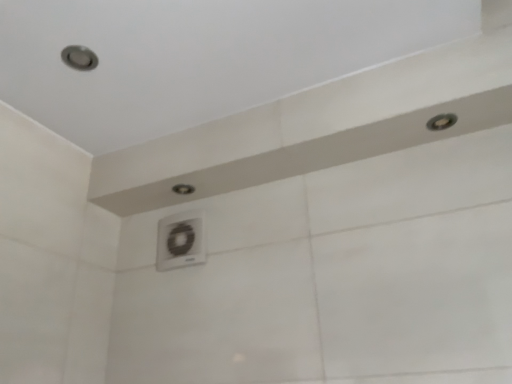
Question: Is white plastic air conditioner at center oriented towards matte white shower at center, placed as the second shower when sorted from right to left?

Choices:
 (A) no
 (B) yes

Answer: (A)

Question: Can you confirm if white plastic air conditioner at center is positioned to the left of matte white shower at center, which is the first shower from back to front?

Choices:
 (A) no
 (B) yes

Answer: (B)

Question: Can matte white shower at center, the first shower ordered from the bottom, be found inside white plastic air conditioner at center?

Choices:
 (A) no
 (B) yes

Answer: (A)

Question: Is white plastic air conditioner at center next to matte white shower at center, which is the first shower from back to front?

Choices:
 (A) yes
 (B) no

Answer: (B)

Question: Is white plastic air conditioner at center turned away from matte white shower at center, the first shower ordered from the bottom?

Choices:
 (A) yes
 (B) no

Answer: (B)

Question: Is matte white shower at center, placed as the second shower when sorted from right to left, inside the boundaries of matte silver shower at upper right, the first shower from the front, or outside?

Choices:
 (A) outside
 (B) inside

Answer: (A)

Question: From the image's perspective, is matte white shower at center, placed as the second shower when sorted from right to left, positioned above or below matte silver shower at upper right, the first shower from the front?

Choices:
 (A) above
 (B) below

Answer: (B)

Question: From a real-world perspective, is matte white shower at center, which is the first shower from back to front, above or below matte silver shower at upper right, which is the first shower in right-to-left order?

Choices:
 (A) below
 (B) above

Answer: (A)

Question: Considering the positions of point (185, 188) and point (435, 127), is point (185, 188) closer or farther from the camera than point (435, 127)?

Choices:
 (A) closer
 (B) farther

Answer: (B)

Question: From a real-world perspective, is matte silver shower at upper right, positioned as the 1th shower in top-to-bottom order, physically located above or below matte white shower at center, placed as the second shower when sorted from right to left?

Choices:
 (A) above
 (B) below

Answer: (A)

Question: Is matte silver shower at upper right, the first shower from the front, bigger or smaller than matte white shower at center, the second shower in the front-to-back sequence?

Choices:
 (A) big
 (B) small

Answer: (B)

Question: From the image's perspective, is matte silver shower at upper right, marked as the 2th shower in a bottom-to-top arrangement, located above or below matte white shower at center, positioned as the 1th shower in left-to-right order?

Choices:
 (A) above
 (B) below

Answer: (A)

Question: Is matte silver shower at upper right, the first shower from the front, to the left or to the right of matte white shower at center, acting as the 2th shower starting from the top, in the image?

Choices:
 (A) right
 (B) left

Answer: (A)

Question: From their relative heights in the image, would you say white plastic air conditioner at center is taller or shorter than matte white shower at center, positioned as the 1th shower in left-to-right order?

Choices:
 (A) tall
 (B) short

Answer: (A)

Question: Would you say white plastic air conditioner at center is inside or outside matte white shower at center, positioned as the 1th shower in left-to-right order?

Choices:
 (A) inside
 (B) outside

Answer: (B)